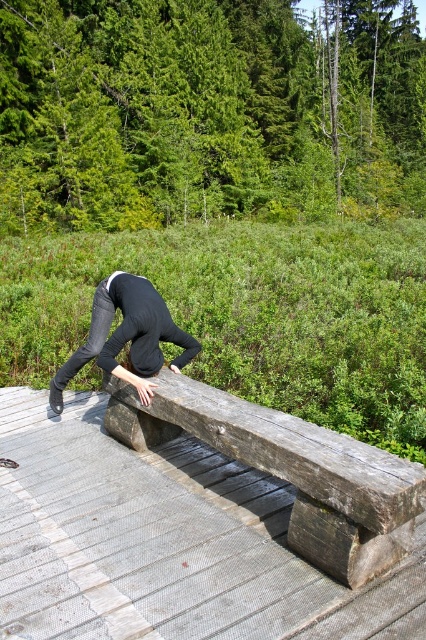
In the scene shown: Is wooden bench at center positioned at the back of dark gray jeans at center?

No, it is not.

Does wooden bench at center come in front of dark gray jeans at center?

Yes, it is in front of dark gray jeans at center.

Which is behind, point (339, 625) or point (135, 380)?

The point (135, 380) is behind.

Where is `wooden bench at center`? wooden bench at center is located at coordinates (164, 541).